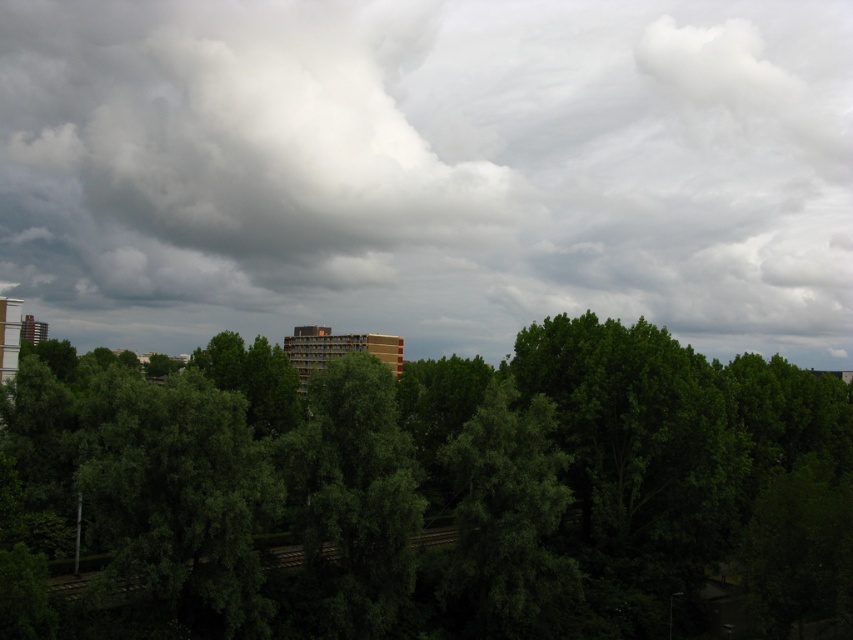
You are an urban planner analyzing the image of the tree canopy and buildings. The white fluffy cloud at upper center is part of the cityscape. Where exactly is this cloud positioned relative to the multi story reddish brown building in the background?

The white fluffy cloud at upper center is located at point (428, 170), which places it above and slightly to the left of the multi story reddish brown building in the background.

You are standing in a park and want to take a photo of the green leafy tree at center. However, there is a white fluffy cloud at upper center in the way. Can you see the tree through the cloud?

The white fluffy cloud at upper center is further to the viewer than green leafy tree at center, so the cloud is closer to you than the tree. This means the cloud would block your view of the tree, making it impossible to see the tree through the cloud.

You are an airplane pilot flying over a forest area. You notice a white fluffy cloud at upper center and a green leafy tree at center in your view. Which object is higher in the sky?

The white fluffy cloud at upper center is higher in the sky than the green leafy tree at center because it is positioned above it.